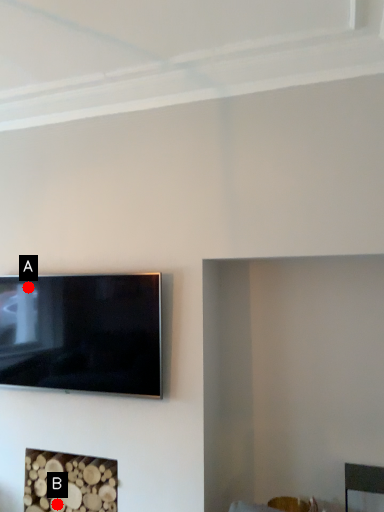
Question: Two points are circled on the image, labeled by A and B beside each circle. Which of the following is the farthest from the observer?

Choices:
 (A) A is further
 (B) B is further

Answer: (A)